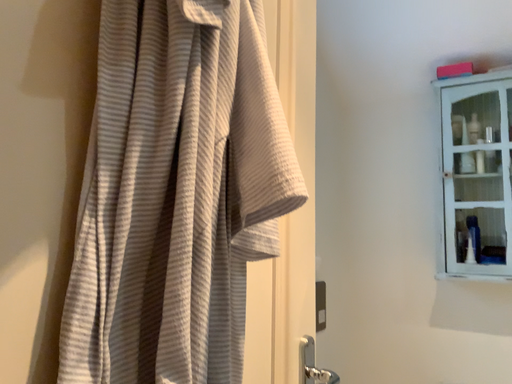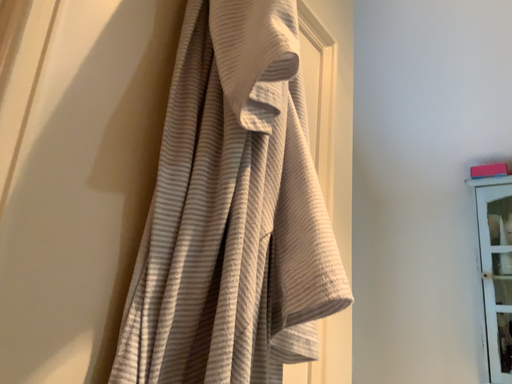
Question: Which way did the camera rotate in the video?

Choices:
 (A) rotated upward
 (B) rotated downward

Answer: (A)